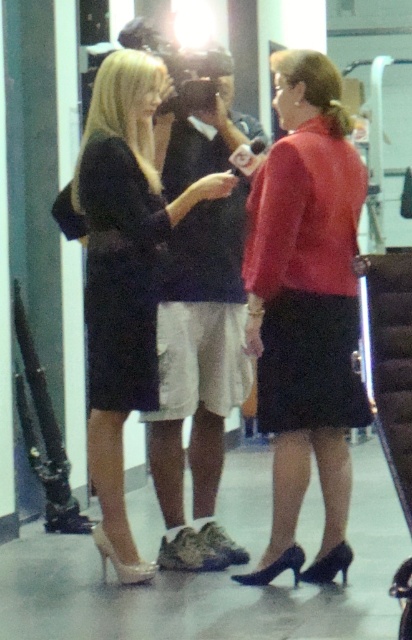
Can you confirm if matte red blouse at center is taller than matte black dress at center?

No, matte red blouse at center is not taller than matte black dress at center.

Is point (259, 289) positioned after point (112, 449)?

No, (259, 289) is closer to viewer.

Between point (316, 563) and point (142, 362), which one is positioned behind?

Point (316, 563)

The height and width of the screenshot is (640, 412). Find the location of `matte red blouse at center`. matte red blouse at center is located at coordinates (306, 308).